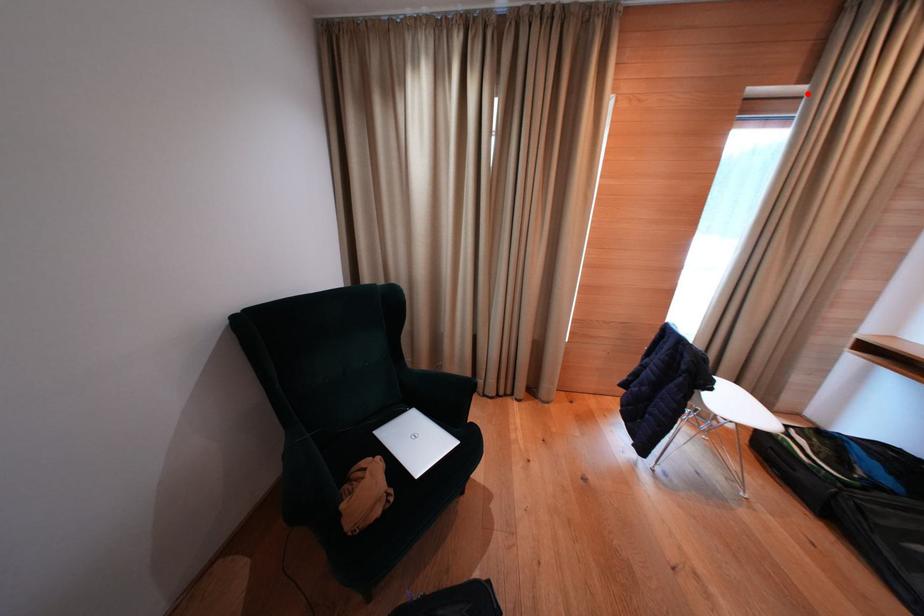
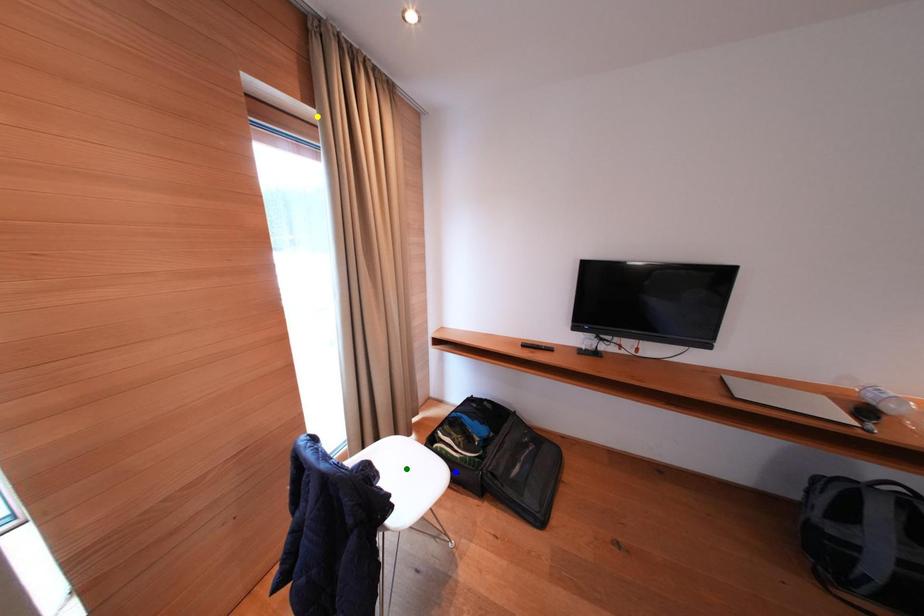
Question: I am providing you with two images of the same scene from different viewpoints. A red point is marked on the first image. You are given multiple points on the second image. In image 2, which mark is for the same physical point as the one in image 1?

Choices:
 (A) blue point
 (B) green point
 (C) yellow point

Answer: (C)